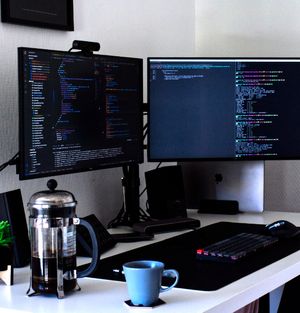
Locate an element on the screen. french press is located at coordinates (52, 243).